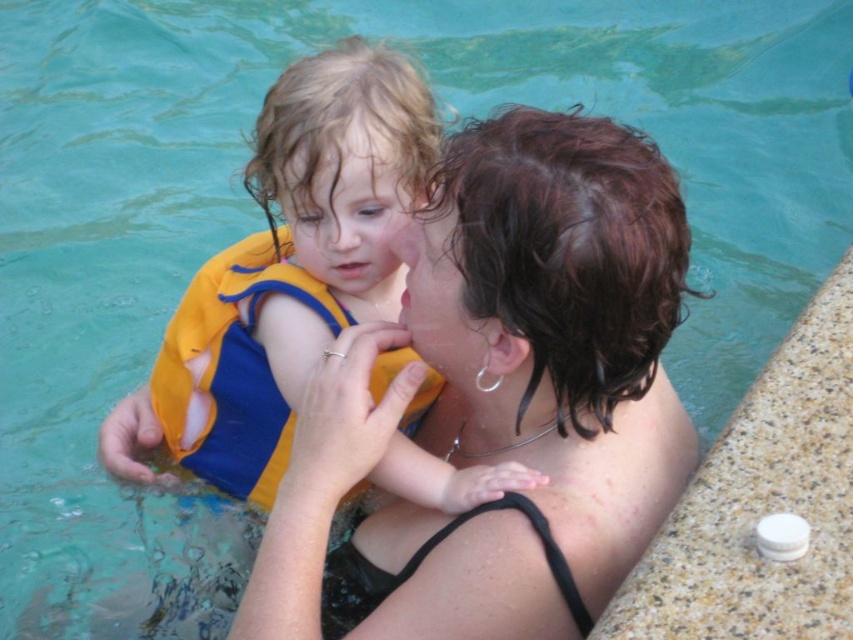
You are standing at the edge of the pool and want to reach the two points in the water. The first point is point (486, 360) and the second is point (415, 184). Since you can only move forward in a straight line, which point should you aim for first to reach the one in front first?

Point (486, 360) is in front of point (415, 184), so you should aim for point (486, 360) first to reach the one in front first.

You are a lifeguard on duty and notice two yellow life vests in the pool area. One is labeled as the yellow life vest at left and the other as the yellow fabric life jacket at center. According to the scene description, which one is covering the other?

The yellow life vest at left is positioned over the yellow fabric life jacket at center, meaning it is covering it.

You are a lifeguard on duty and notice two yellow flotation devices in the pool area. The yellow life vest at left and the yellow fabric life jacket at center. Which one is bigger in size?

The yellow life vest at left is larger in size compared to the yellow fabric life jacket at center.